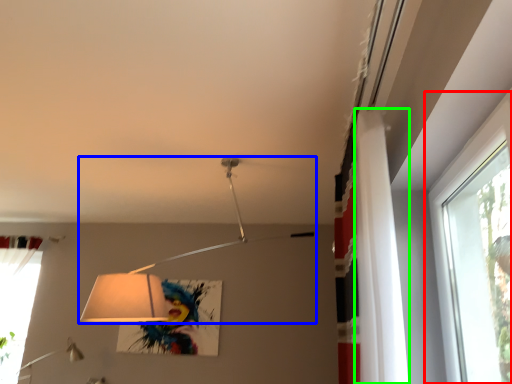
Question: Which object is the farthest from window (highlighted by a red box)? Choose among these: lamp (highlighted by a blue box) or curtain (highlighted by a green box).

Choices:
 (A) lamp
 (B) curtain

Answer: (A)